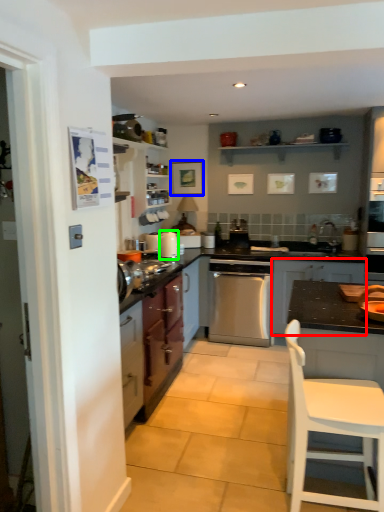
Question: Estimate the real-world distances between objects in this image. Which object is closer to cabinetry (highlighted by a red box), picture frame (highlighted by a blue box) or kitchen appliance (highlighted by a green box)?

Choices:
 (A) picture frame
 (B) kitchen appliance

Answer: (B)